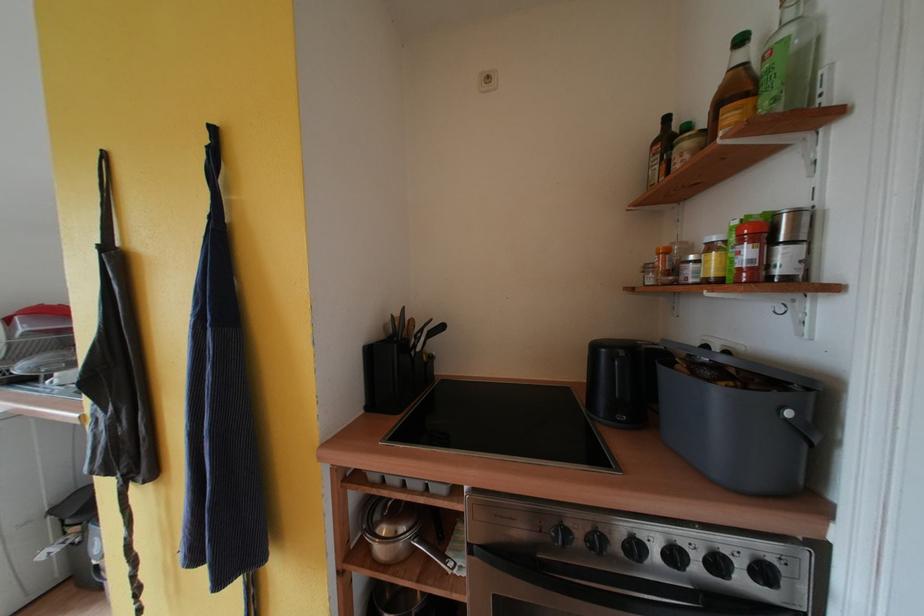
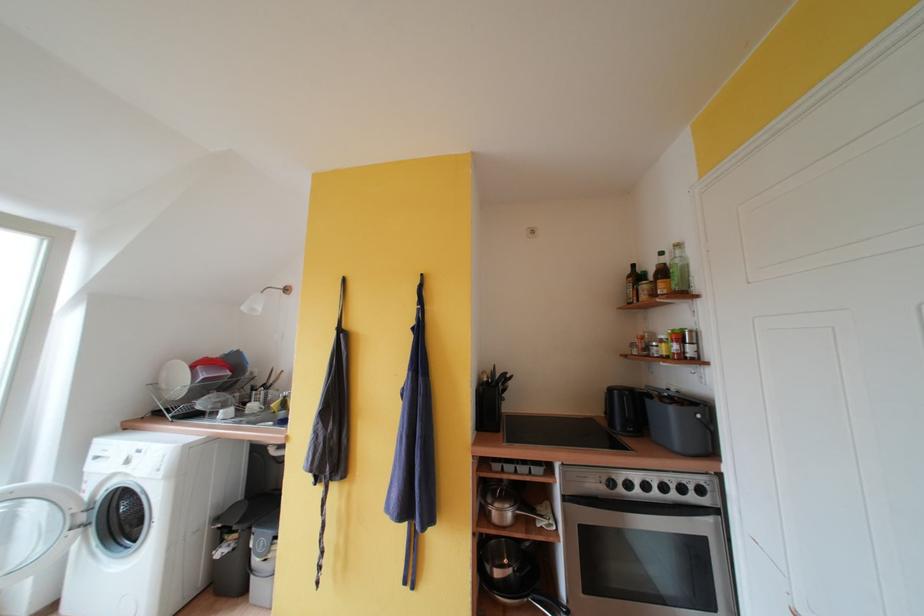
Find the pixel in the second image that matches [659,541] in the first image.

(660, 484)